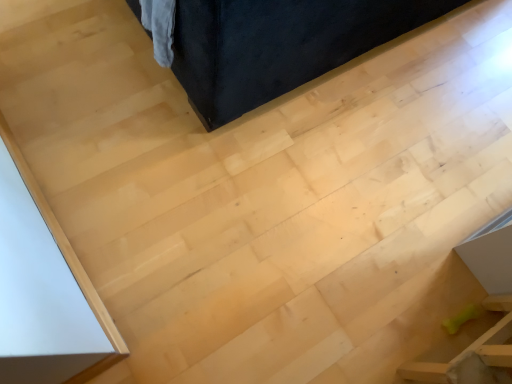
Question: Is green rubber bone at lower right, arranged as the first furniture when ordered from the bottom, oriented towards velvet dark blue couch at upper center, the first furniture from the top?

Choices:
 (A) yes
 (B) no

Answer: (B)

Question: Does green rubber bone at lower right, acting as the second furniture starting from the top, appear on the right side of velvet dark blue couch at upper center, the first furniture from the top?

Choices:
 (A) yes
 (B) no

Answer: (A)

Question: Is green rubber bone at lower right, acting as the second furniture starting from the top, completely or partially outside of velvet dark blue couch at upper center, the first furniture from the top?

Choices:
 (A) no
 (B) yes

Answer: (B)

Question: Is green rubber bone at lower right, acting as the second furniture starting from the top, smaller than velvet dark blue couch at upper center, placed as the 2th furniture when sorted from bottom to top?

Choices:
 (A) yes
 (B) no

Answer: (A)

Question: From a real-world perspective, is green rubber bone at lower right, arranged as the first furniture when ordered from the bottom, located beneath velvet dark blue couch at upper center, the first furniture from the top?

Choices:
 (A) yes
 (B) no

Answer: (A)

Question: From the image's perspective, is green rubber bone at lower right, acting as the second furniture starting from the top, located above velvet dark blue couch at upper center, placed as the 2th furniture when sorted from bottom to top?

Choices:
 (A) yes
 (B) no

Answer: (B)

Question: Is velvet dark blue couch at upper center, the first furniture from the top, facing away from green rubber bone at lower right, arranged as the first furniture when ordered from the bottom?

Choices:
 (A) no
 (B) yes

Answer: (B)

Question: Can you confirm if velvet dark blue couch at upper center, the first furniture from the top, is thinner than green rubber bone at lower right, arranged as the first furniture when ordered from the bottom?

Choices:
 (A) yes
 (B) no

Answer: (B)

Question: Can you confirm if velvet dark blue couch at upper center, the first furniture from the top, is smaller than green rubber bone at lower right, acting as the second furniture starting from the top?

Choices:
 (A) no
 (B) yes

Answer: (A)

Question: Is velvet dark blue couch at upper center, the first furniture from the top, shorter than green rubber bone at lower right, arranged as the first furniture when ordered from the bottom?

Choices:
 (A) yes
 (B) no

Answer: (B)

Question: Is velvet dark blue couch at upper center, the first furniture from the top, not close to green rubber bone at lower right, arranged as the first furniture when ordered from the bottom?

Choices:
 (A) yes
 (B) no

Answer: (B)

Question: Could green rubber bone at lower right, arranged as the first furniture when ordered from the bottom, be considered to be inside velvet dark blue couch at upper center, the first furniture from the top?

Choices:
 (A) yes
 (B) no

Answer: (B)

Question: From the image's perspective, relative to velvet dark blue couch at upper center, placed as the 2th furniture when sorted from bottom to top, is green rubber bone at lower right, acting as the second furniture starting from the top, above or below?

Choices:
 (A) above
 (B) below

Answer: (B)